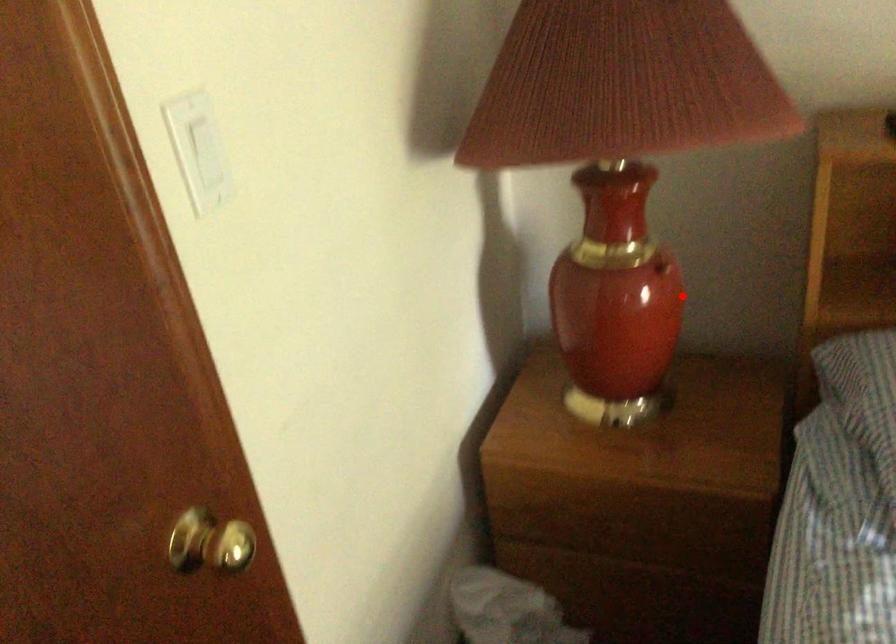
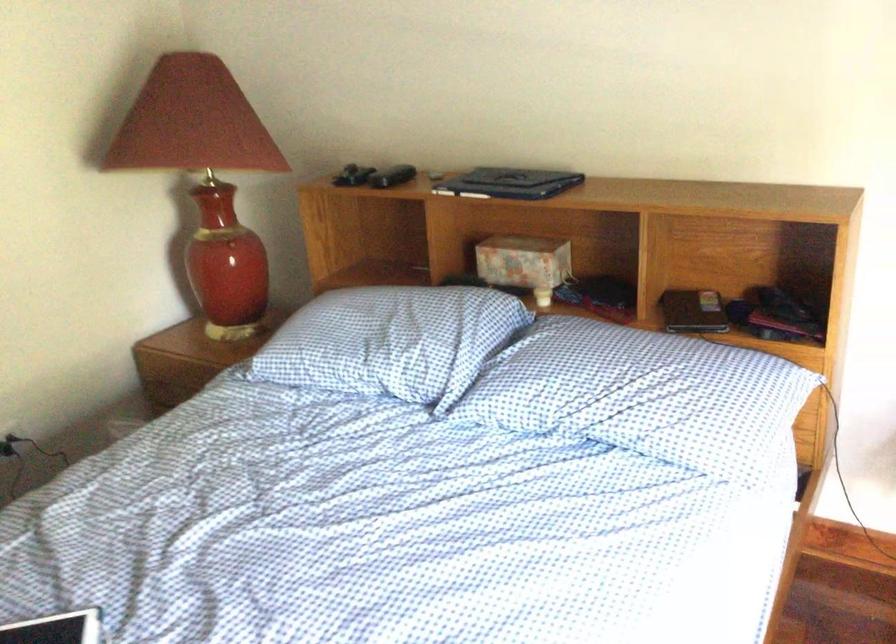
Question: I am providing you with two images of the same scene from different viewpoints. In image1, a red point is highlighted. Considering the same 3D point in image2, which of the following is correct?

Choices:
 (A) It is closer
 (B) It is farther

Answer: (B)